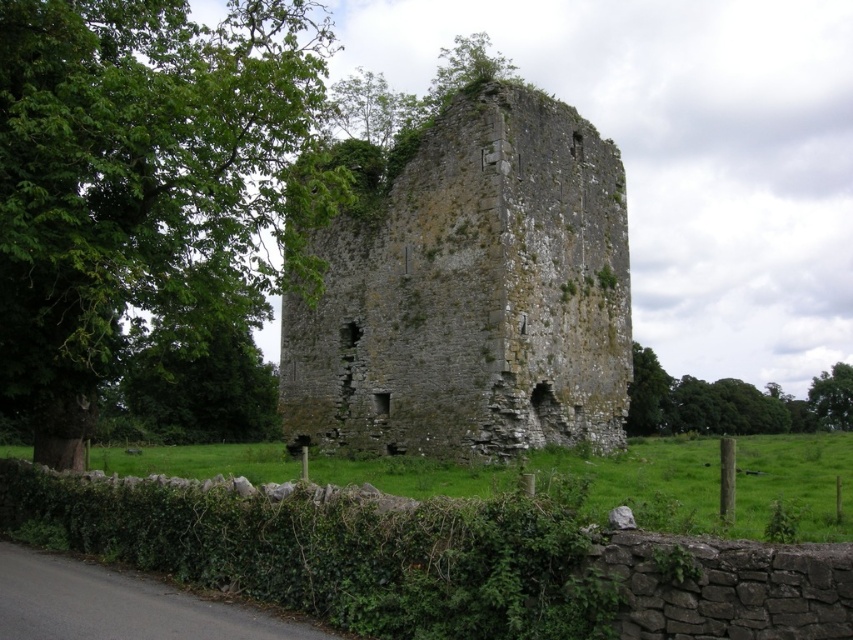
You are standing in the field near the stone tower at center and the green leafy tree at upper center. Which object is closer to your right side?

The green leafy tree at upper center is closer to your right side because the stone tower at center is positioned on the left side of it.

You are standing in the field near the stone tower at center and the green leafy tree at upper center. Which object is nearer to you?

The stone tower at center is closer to the viewer than the green leafy tree at upper center, so the stone tower at center is nearer to you.